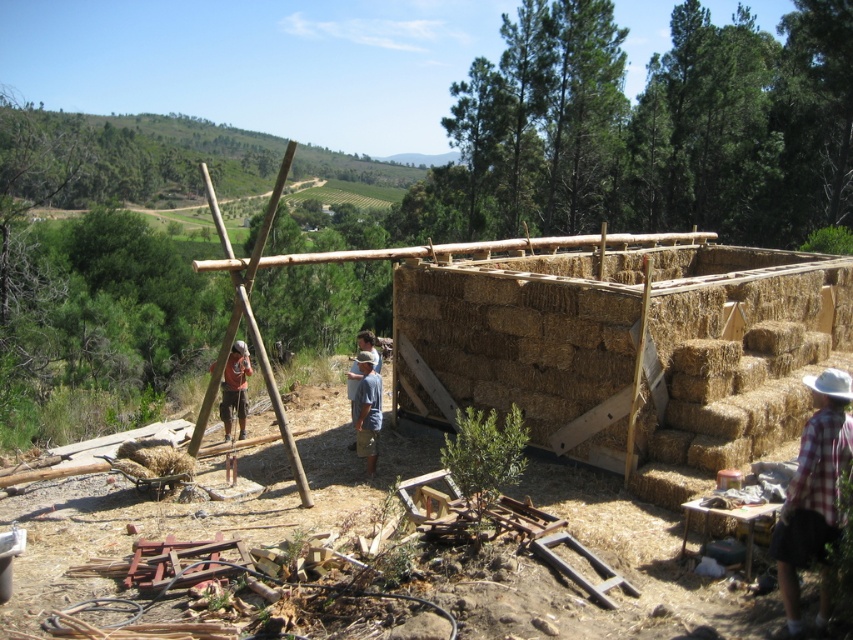
Question: Is plaid fabric shirt at lower right bigger than blue denim jeans at center?

Choices:
 (A) yes
 (B) no

Answer: (B)

Question: Which of the following is the farthest from the observer?

Choices:
 (A) (358, 428)
 (B) (236, 403)

Answer: (B)

Question: Does blue denim jeans at center have a lesser width compared to brown wood construction worker at center?

Choices:
 (A) no
 (B) yes

Answer: (B)

Question: Which object is closer to the camera taking this photo?

Choices:
 (A) brown wood construction worker at center
 (B) plaid fabric shirt at lower right

Answer: (B)

Question: Does plaid fabric shirt at lower right appear on the right side of blue denim jeans at center?

Choices:
 (A) no
 (B) yes

Answer: (B)

Question: Among these objects, which one is nearest to the camera?

Choices:
 (A) blue denim jeans at center
 (B) plaid fabric shirt at lower right

Answer: (B)